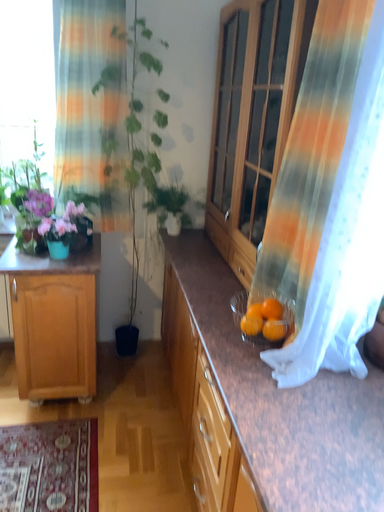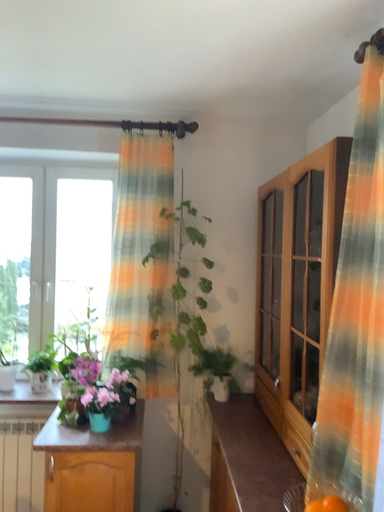
Question: Which way did the camera rotate in the video?

Choices:
 (A) rotated downward
 (B) rotated upward

Answer: (B)